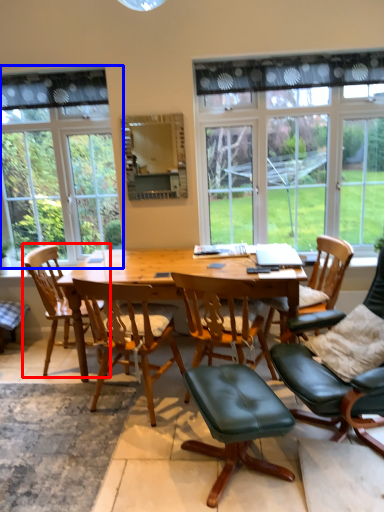
Question: Which point is closer to the camera, chair (highlighted by a red box) or window (highlighted by a blue box)?

Choices:
 (A) chair
 (B) window

Answer: (A)